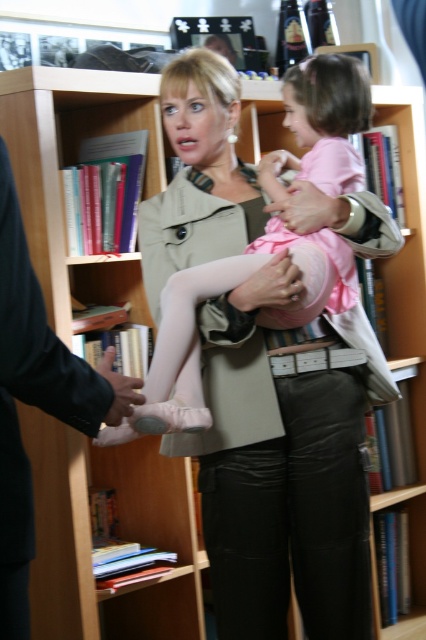
You are a photographer trying to capture a closeup of the matte beige hand at center and the black leather hand at lower left. Since you want both hands to appear the same size in the photo, which hand should you move closer to the camera and why?

You should move the matte beige hand at center closer to the camera because it is smaller in size compared to the black leather hand at lower left. By positioning it nearer, the smaller hand will appear larger in the photo, balancing their sizes.